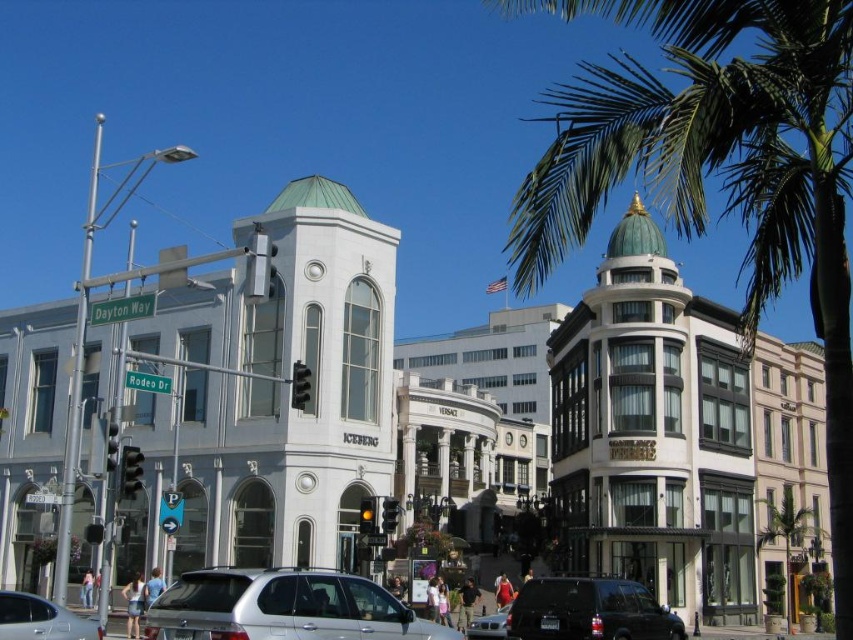
You are a delivery driver who needs to park your truck between the shiny black suv at lower center and the silver metallic car at lower left. Your truck is 6 meters long. Is there enough space between them to park your truck?

The distance between the shiny black suv at lower center and the silver metallic car at lower left is 21.98 meters. Since your truck is only 6 meters long, there is sufficient space to park between them.

You are a delivery driver who needs to park your silver metallic car at lower left in a specific spot. The parking spot you need is at coordinate point 0.969, 0.049. Is your car already in the correct parking spot?

Yes, the silver metallic car at lower left is already positioned at the required coordinate point (x=41, y=620).

You are a pedestrian standing at the intersection and want to walk to the green leafy palm tree at upper right. Which direction should you turn to avoid the shiny black suv at lower center?

The green leafy palm tree at upper right is positioned on the right side of the shiny black suv at lower center. To avoid the shiny black suv at lower center, turn right towards the green leafy palm tree at upper right.